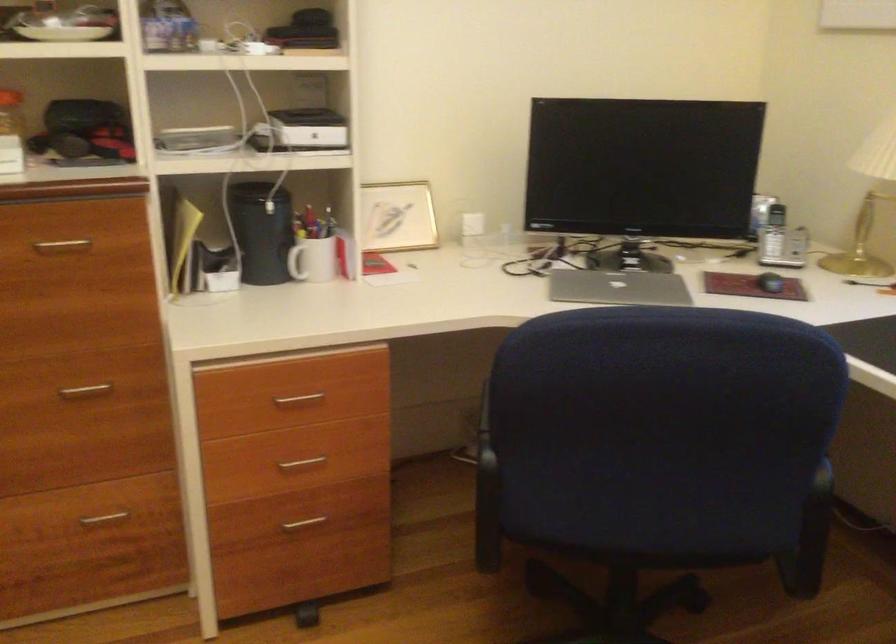
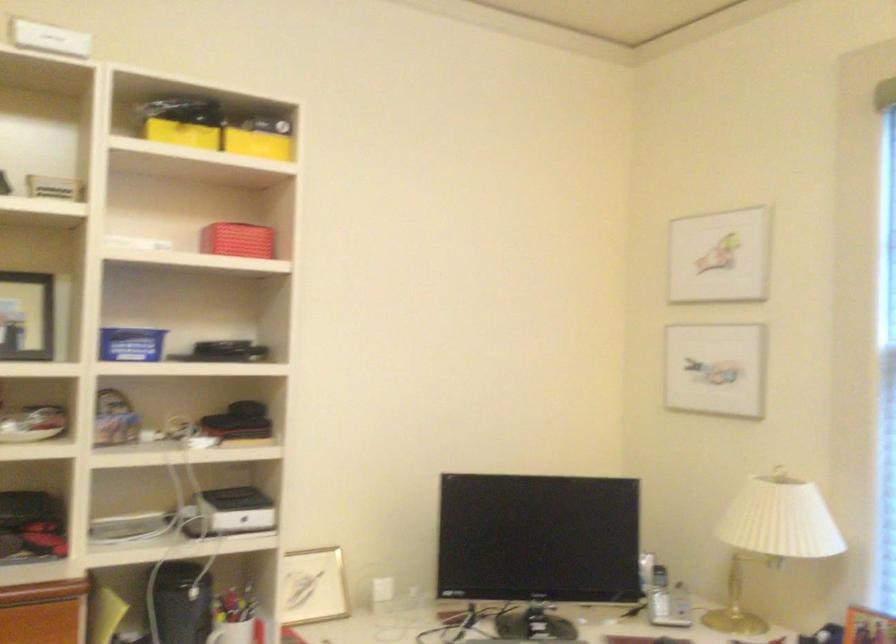
Question: The first image is from the beginning of the video and the second image is from the end. How did the camera likely rotate when shooting the video?

Choices:
 (A) Left
 (B) Right
 (C) Up
 (D) Down

Answer: (C)